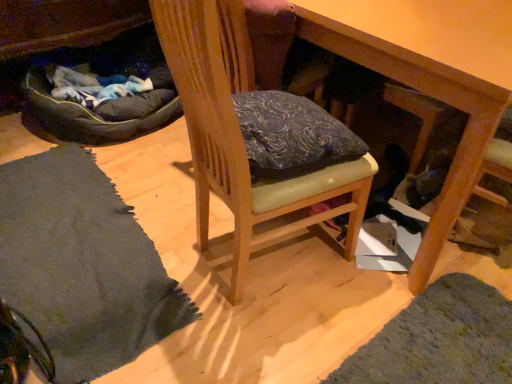
Image resolution: width=512 pixels, height=384 pixels. Find the location of `free point to the left of wooden chair at center`. free point to the left of wooden chair at center is located at coordinates (176, 252).